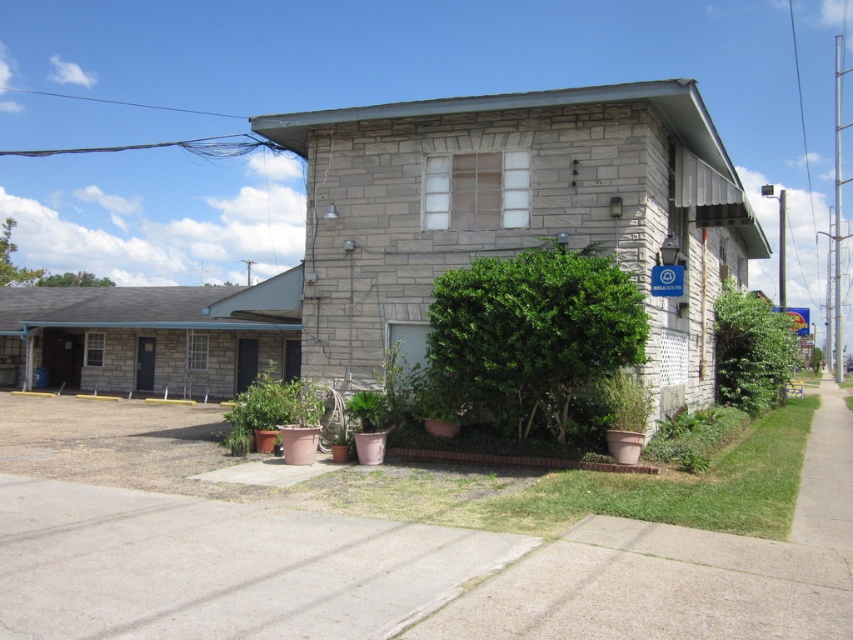
Is point (641, 420) farther from viewer compared to point (367, 397)?

No, it is in front of (367, 397).

Does green matte planter at lower right appear on the left side of green matte plant at lower center?

Incorrect, green matte planter at lower right is not on the left side of green matte plant at lower center.

The height and width of the screenshot is (640, 853). I want to click on green matte planter at lower right, so click(625, 401).

Image resolution: width=853 pixels, height=640 pixels. What are the coordinates of `green matte planter at lower right` in the screenshot? It's located at (625, 401).

Is green leafy bush at right positioned at the back of matte terracotta pot at center?

Yes.

Between green leafy bush at right and matte terracotta pot at center, which one appears on the left side from the viewer's perspective?

matte terracotta pot at center

Locate an element on the screen. green leafy bush at right is located at coordinates (750, 349).

Can you confirm if green leafy bush at right is wider than green matte planter at lower right?

Correct, the width of green leafy bush at right exceeds that of green matte planter at lower right.

Which of these two, green leafy bush at right or green matte planter at lower right, stands shorter?

green matte planter at lower right is shorter.

Is point (718, 378) closer to viewer compared to point (621, 388)?

No, it is behind (621, 388).

Where is `green leafy bush at right`? This screenshot has height=640, width=853. green leafy bush at right is located at coordinates (750, 349).